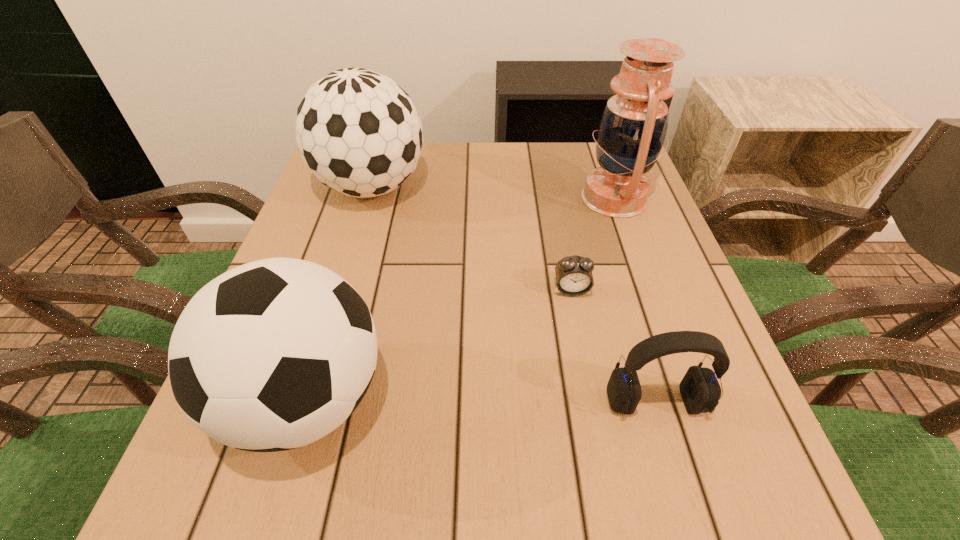
The image size is (960, 540). Find the location of `blank space located on the front side of the third farthest object`. blank space located on the front side of the third farthest object is located at coordinates (606, 472).

I want to click on oil lamp that is positioned at the far edge, so click(x=632, y=130).

The image size is (960, 540). Find the location of `soccer ball positioned at the far edge`. soccer ball positioned at the far edge is located at coordinates (358, 131).

The width and height of the screenshot is (960, 540). In order to click on object at the near edge in this screenshot , I will do `click(272, 355)`.

Find the location of a particular element. The width and height of the screenshot is (960, 540). oil lamp at the right edge is located at coordinates (632, 130).

Locate an element on the screen. This screenshot has height=540, width=960. headset at the right edge is located at coordinates (700, 390).

Find the location of `object located at the far left corner`. object located at the far left corner is located at coordinates tap(358, 131).

This screenshot has width=960, height=540. I want to click on object situated at the near left corner, so click(x=272, y=355).

Where is `object located in the far right corner section of the desktop`? object located in the far right corner section of the desktop is located at coordinates (632, 130).

The height and width of the screenshot is (540, 960). What are the coordinates of `vacant point at the far edge` in the screenshot? It's located at (466, 161).